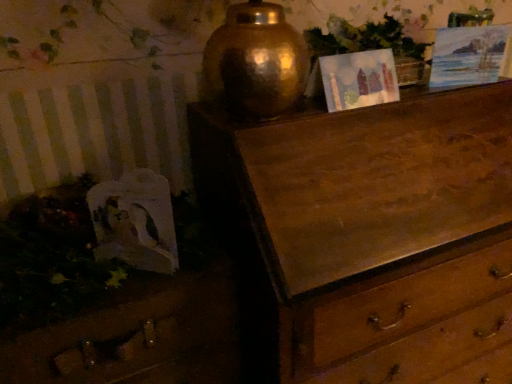
Question: Is matte paper picture frame at upper center, which is counted as the first picture frame, starting from the left, to the left of watercolor paper picture frame at upper right, placed as the first picture frame when sorted from right to left, from the viewer's perspective?

Choices:
 (A) yes
 (B) no

Answer: (A)

Question: Is matte paper picture frame at upper center, the 2th picture frame in the right-to-left sequence, facing towards watercolor paper picture frame at upper right, placed as the first picture frame when sorted from right to left?

Choices:
 (A) yes
 (B) no

Answer: (B)

Question: Is matte paper picture frame at upper center, the 2th picture frame in the right-to-left sequence, wider than watercolor paper picture frame at upper right, acting as the 2th picture frame starting from the left?

Choices:
 (A) yes
 (B) no

Answer: (A)

Question: From a real-world perspective, is matte paper picture frame at upper center, which is counted as the first picture frame, starting from the left, beneath watercolor paper picture frame at upper right, placed as the first picture frame when sorted from right to left?

Choices:
 (A) no
 (B) yes

Answer: (B)

Question: Does matte paper picture frame at upper center, which is counted as the first picture frame, starting from the left, lie in front of watercolor paper picture frame at upper right, acting as the 2th picture frame starting from the left?

Choices:
 (A) yes
 (B) no

Answer: (A)

Question: Is watercolor paper picture frame at upper right, acting as the 2th picture frame starting from the left, completely or partially inside matte paper picture frame at upper center, which is counted as the first picture frame, starting from the left?

Choices:
 (A) no
 (B) yes

Answer: (A)

Question: Considering the relative sizes of green leafy plant at upper center and wooden drawer at lower left in the image provided, is green leafy plant at upper center smaller than wooden drawer at lower left?

Choices:
 (A) yes
 (B) no

Answer: (A)

Question: From a real-world perspective, is green leafy plant at upper center located higher than wooden drawer at lower left?

Choices:
 (A) yes
 (B) no

Answer: (A)

Question: Does green leafy plant at upper center lie behind wooden drawer at lower left?

Choices:
 (A) no
 (B) yes

Answer: (B)

Question: Is green leafy plant at upper center facing away from wooden drawer at lower left?

Choices:
 (A) yes
 (B) no

Answer: (B)

Question: Can you confirm if green leafy plant at upper center is wider than wooden drawer at lower left?

Choices:
 (A) no
 (B) yes

Answer: (A)

Question: Is green leafy plant at upper center to the left of wooden drawer at lower left from the viewer's perspective?

Choices:
 (A) yes
 (B) no

Answer: (B)

Question: Does wooden drawer at lower left turn towards watercolor paper picture frame at upper right, acting as the 2th picture frame starting from the left?

Choices:
 (A) yes
 (B) no

Answer: (B)